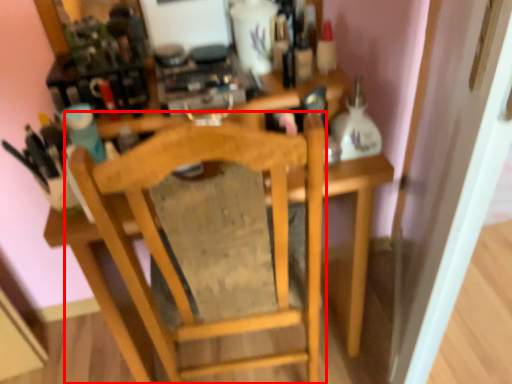
Question: From the image, what is the correct spatial relationship of chair (annotated by the red box) in relation to door?

Choices:
 (A) right
 (B) left

Answer: (B)